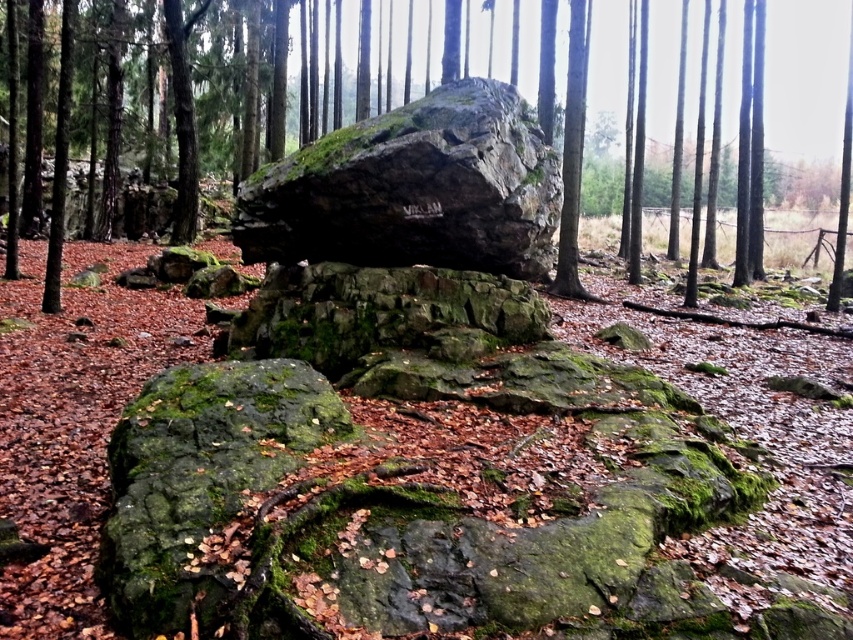
You are a hiker who wants to place a 10 meter long tent between the green mossy rock at center and the rough textured rock at center. Can the tent fit between them?

The green mossy rock at center and the rough textured rock at center are 10.38 meters apart. Since the tent is 10 meters long, it can fit between them with 0.38 meters of space remaining.

You are an explorer in the forest and need to place a small backpack between the green mossy rock at center and the rough textured rock at center. Which rock should you choose to place it next to if you want the backpack to be more visible?

The green mossy rock at center is bigger than the rough textured rock at center, so placing the backpack next to the green mossy rock at center would make it more visible due to its larger size.

You are a hiker trying to cross a narrow path between two rocks. The path is between the green mossy rock at center and the rough textured rock at center. Which rock has a wider base to step on?

The green mossy rock at center has a wider base than the rough textured rock at center, so it is safer to step on the green mossy rock at center.